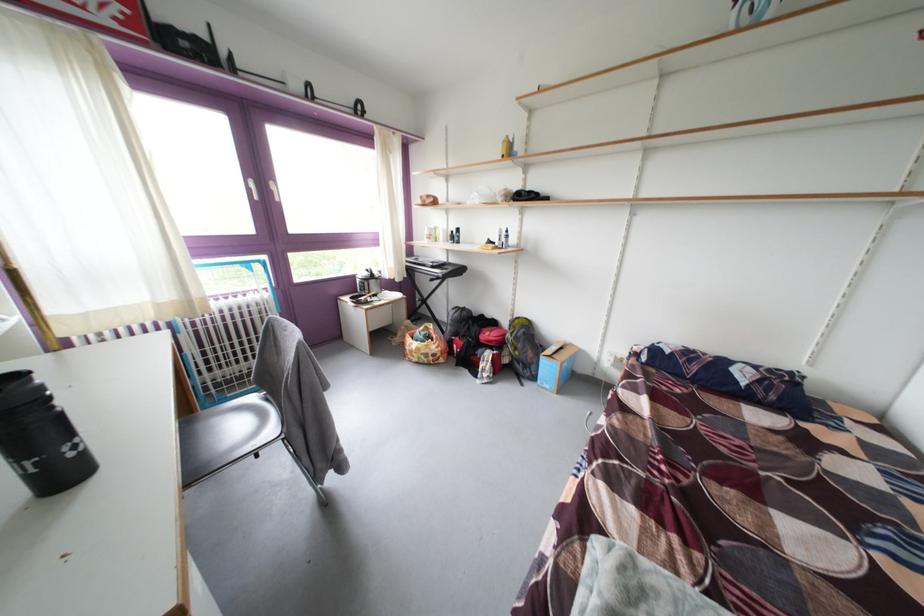
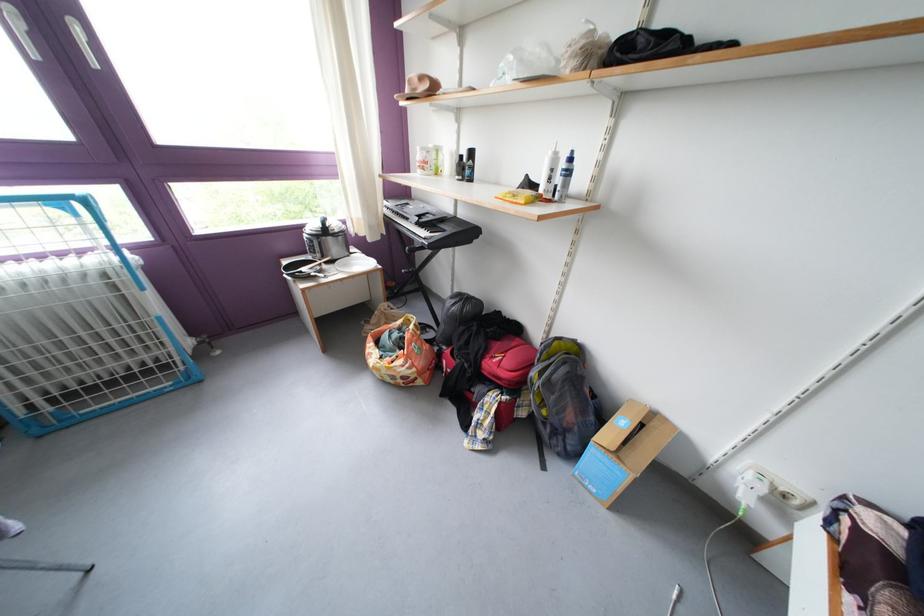
In the second image, find the point that corresponds to (x=443, y=273) in the first image.

(430, 229)